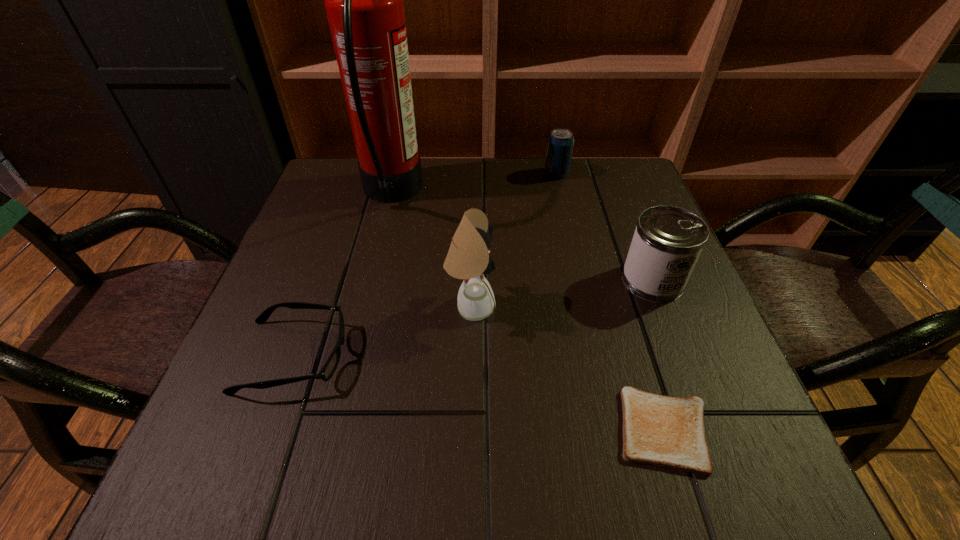
In order to click on vacant region located 0.330m on the left of the pop soda in this screenshot , I will do `click(417, 173)`.

Image resolution: width=960 pixels, height=540 pixels. What are the coordinates of `free space located 0.270m on the front-facing side of the second shortest object` in the screenshot? It's located at [x=506, y=356].

Locate an element on the screen. The width and height of the screenshot is (960, 540). free space located 0.070m on the right of the toast is located at coordinates [759, 430].

Locate an element on the screen. fire extinguisher positioned at the far edge is located at coordinates (363, 0).

The image size is (960, 540). Identify the location of pop soda situated at the far edge. (560, 143).

Identify the location of object present at the near edge. This screenshot has width=960, height=540. (662, 431).

At what (x,y) coordinates should I click in order to perform the action: click on fire extinguisher that is at the left edge. Please return your answer as a coordinate pair (x, y). The width and height of the screenshot is (960, 540). Looking at the image, I should click on (363, 0).

Where is `spectacles present at the left edge`? spectacles present at the left edge is located at coordinates [329, 368].

Locate an element on the screen. can located at the right edge is located at coordinates (667, 242).

What are the coordinates of `toast that is at the right edge` in the screenshot? It's located at (662, 431).